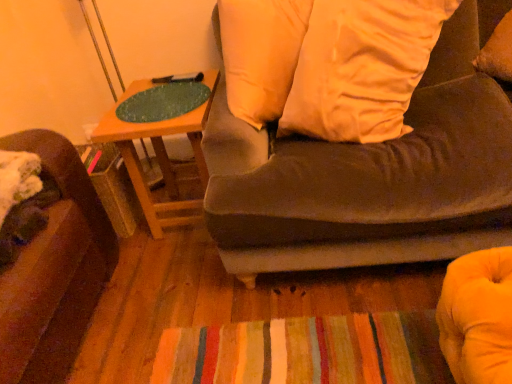
The image size is (512, 384). I want to click on free space underneath green felt at upper left (from a real-world perspective), so click(x=160, y=97).